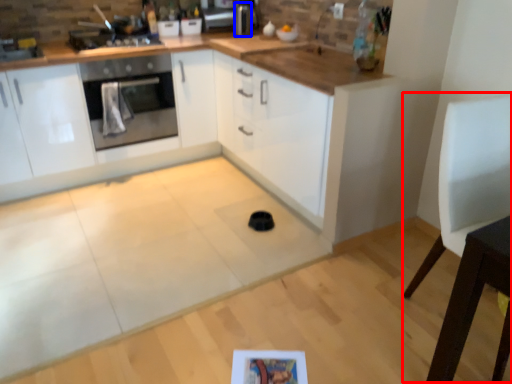
Question: Among these objects, which one is nearest to the camera, chair (highlighted by a red box) or appliance (highlighted by a blue box)?

Choices:
 (A) chair
 (B) appliance

Answer: (A)